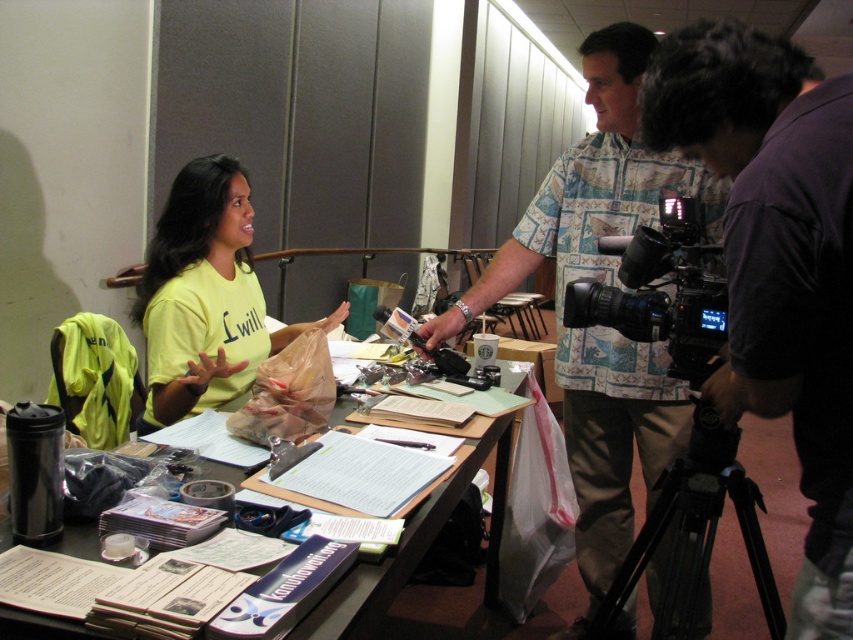
Question: Among these objects, which one is nearest to the camera?

Choices:
 (A) black matte video camera at center
 (B) purple cotton shirt at right
 (C) yellow matte shirt at center
 (D) floral shirt at center

Answer: (B)

Question: In this image, where is purple cotton shirt at right located relative to floral shirt at center?

Choices:
 (A) right
 (B) left

Answer: (A)

Question: Which object is the farthest from the floral shirt at center?

Choices:
 (A) black matte video camera at center
 (B) white paper table at center

Answer: (B)

Question: Which of the following is the farthest from the observer?

Choices:
 (A) (612, 284)
 (B) (753, 401)
 (C) (689, 460)

Answer: (A)

Question: Is black matte video camera at center to the right of white paper table at center from the viewer's perspective?

Choices:
 (A) yes
 (B) no

Answer: (A)

Question: Observing the image, what is the correct spatial positioning of purple cotton shirt at right in reference to yellow matte shirt at center?

Choices:
 (A) left
 (B) right

Answer: (B)